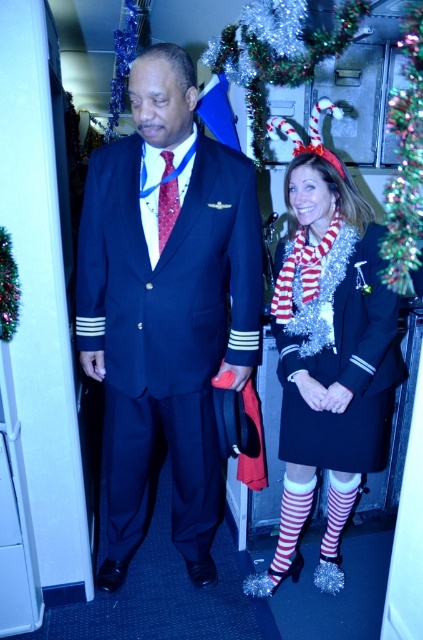
You are a photographer who needs to capture both the shiny dark blue suit at center and the shiny silver dress at center in the same frame. Based on their positions, which one should you focus on first to ensure both are in the frame?

The shiny dark blue suit at center is positioned on the left side of the shiny silver dress at center, so you should focus on the shiny silver dress at center first to ensure both are in the frame.

You are a passenger on an airplane and you want to place your red and white striped stockings at right into a nearby overhead compartment. The overhead compartment is located at point (329, 358). Can you determine if the stockings will fit inside the compartment?

The red and white striped stockings at right are located at point (329, 358), which is where the overhead compartment is. Therefore, the stockings can be placed directly into the overhead compartment at that location.

You are a photographer taking a photo of the shiny dark blue suit at center and the red and white striped stockings at right. Which object should you focus on first if you want to capture both clearly in the same frame?

You should focus on the shiny dark blue suit at center first because it is closer to the viewer than the red and white striped stockings at right, ensuring both are in focus when using a shallow depth of field.